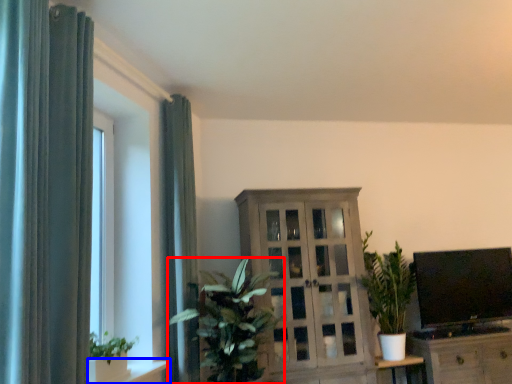
Question: Which point is further to the camera, houseplant (highlighted by a red box) or shelf (highlighted by a blue box)?

Choices:
 (A) houseplant
 (B) shelf

Answer: (A)